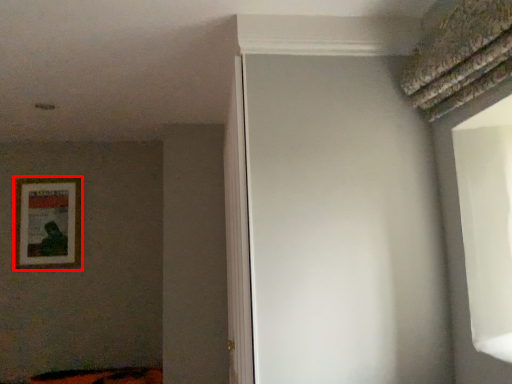
Question: Where is picture frame (annotated by the red box) located in relation to screen door in the image?

Choices:
 (A) right
 (B) left

Answer: (B)